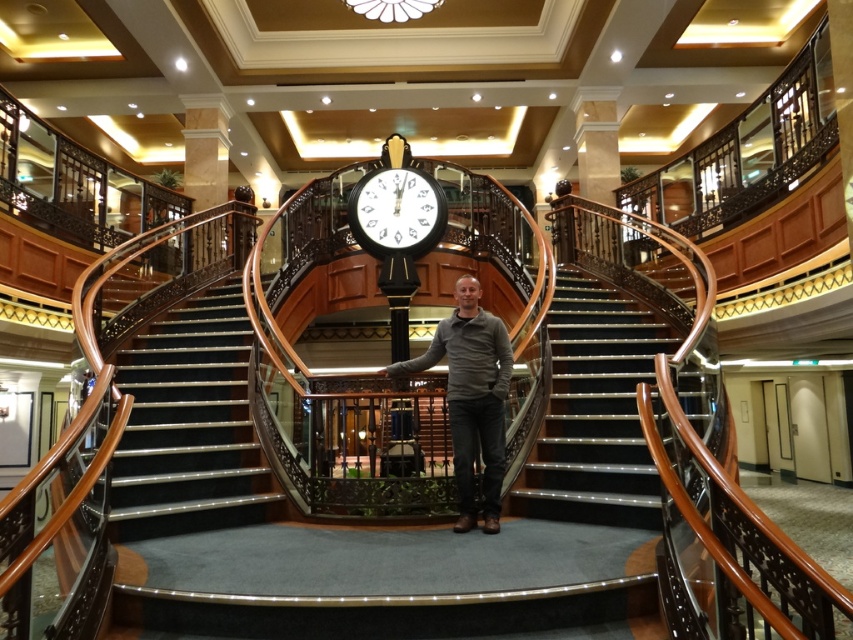
Question: Does polished wood stairs at center have a lesser width compared to white marble pillar at upper center?

Choices:
 (A) no
 (B) yes

Answer: (A)

Question: Which point is farther to the camera?

Choices:
 (A) wooden stairs at center
 (B) white marble pillar at upper center

Answer: (B)

Question: Does polished wood stairs at center have a greater width compared to marble column at upper center?

Choices:
 (A) no
 (B) yes

Answer: (B)

Question: Does dark gray sweater at center have a larger size compared to black glossy clock at center?

Choices:
 (A) yes
 (B) no

Answer: (A)

Question: Which is farther from the marble column at upper center?

Choices:
 (A) black glossy clock at center
 (B) wooden stairs at center
 (C) white marble pillar at upper center
 (D) dark gray sweater at center

Answer: (D)

Question: Which point appears closest to the camera in this image?

Choices:
 (A) (585, 163)
 (B) (555, 474)
 (C) (206, 150)

Answer: (B)